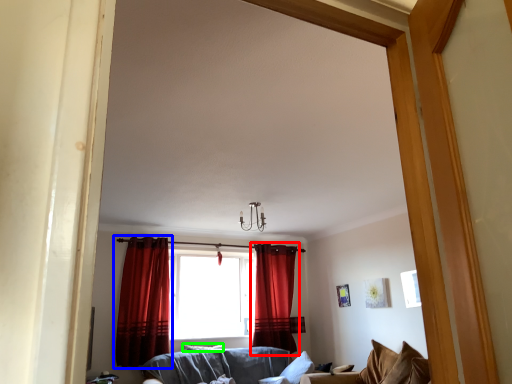
Question: Which is nearer to the curtain (highlighted by a red box)? curtain (highlighted by a blue box) or pillow (highlighted by a green box).

Choices:
 (A) curtain
 (B) pillow

Answer: (B)